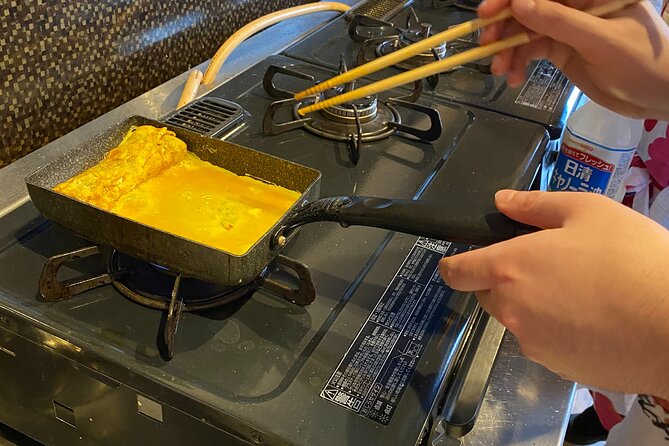
In order to click on stove top in this screenshot , I will do `click(494, 154)`, `click(504, 99)`.